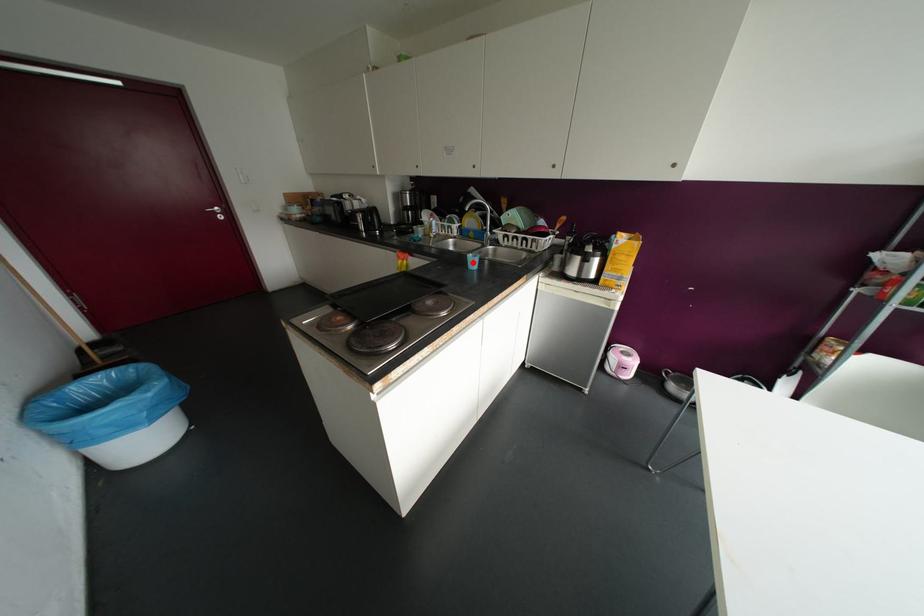
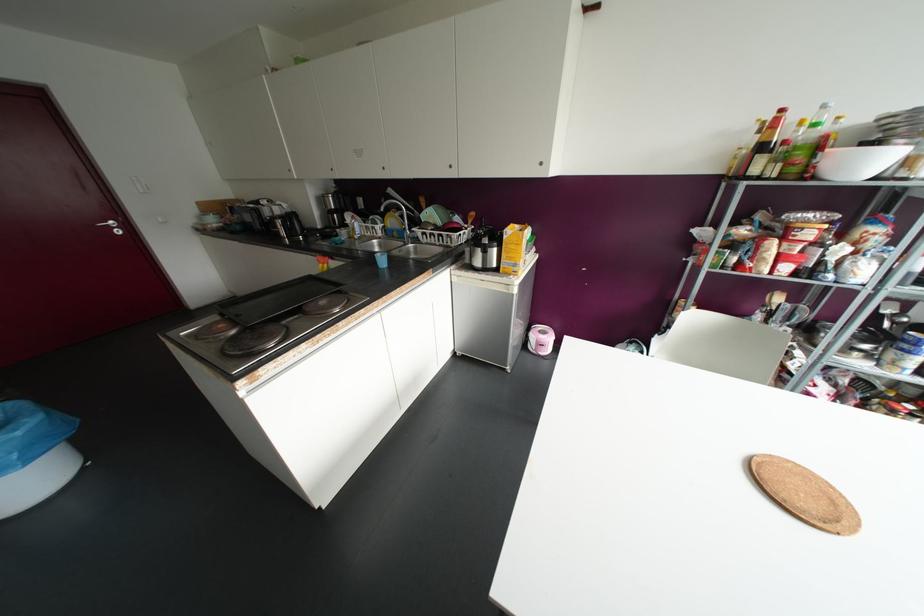
In the second image, find the point that corresponds to the highlighted location in the first image.

(382, 261)